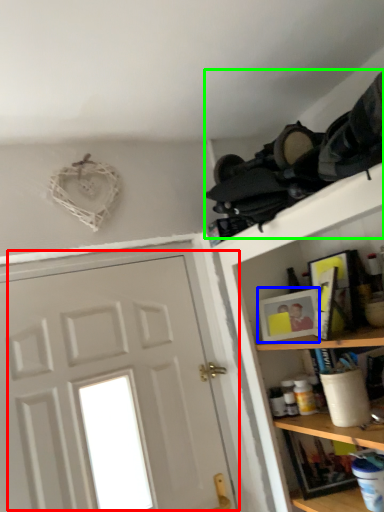
Question: Estimate the real-world distances between objects in this image. Which object is farther from door (highlighted by a red box), picture frame (highlighted by a blue box) or laundry (highlighted by a green box)?

Choices:
 (A) picture frame
 (B) laundry

Answer: (B)